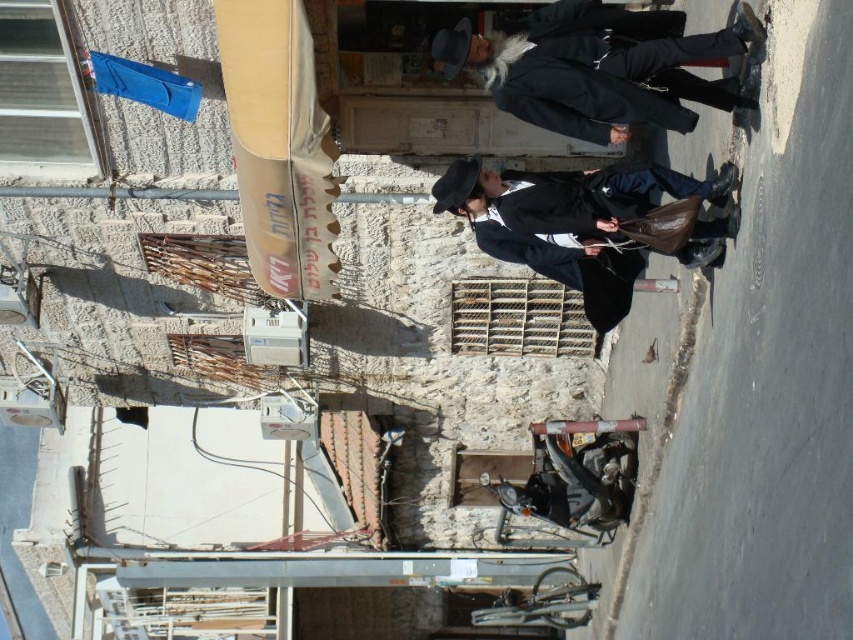
Between point (679, 58) and point (601, 276), which one is positioned in front?

Point (679, 58) is more forward.

This screenshot has width=853, height=640. Identify the location of dark wool coat at center. (598, 67).